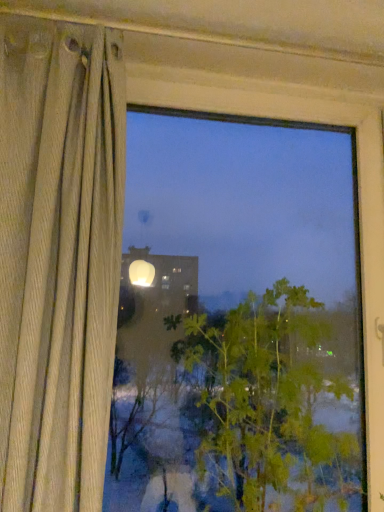
This screenshot has height=512, width=384. What do you see at coordinates (269, 402) in the screenshot? I see `green leafy plant at center` at bounding box center [269, 402].

Find the location of a particular element. green leafy plant at center is located at coordinates (269, 402).

Identify the location of green leafy plant at center. The image size is (384, 512). (269, 402).